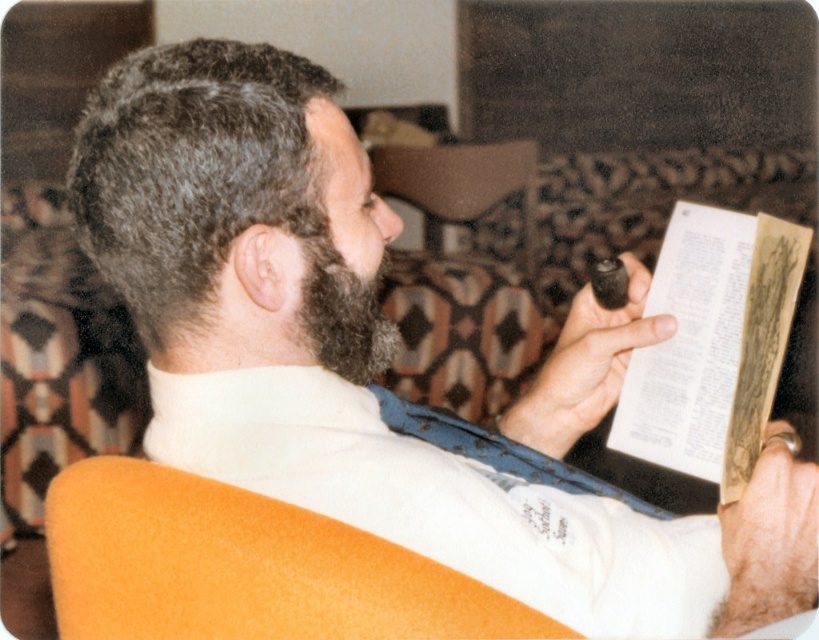
Question: Is orange fabric armchair at lower left to the left of dark brown fuzzy beard at center from the viewer's perspective?

Choices:
 (A) no
 (B) yes

Answer: (B)

Question: Which object is the closest to the dark brown fuzzy beard at center?

Choices:
 (A) orange fabric armchair at lower left
 (B) yellowed paper book at right

Answer: (A)

Question: Which point appears farthest from the camera in this image?

Choices:
 (A) (657, 257)
 (B) (133, 488)
 (C) (356, 360)

Answer: (A)

Question: Can you confirm if orange fabric armchair at lower left is wider than yellowed paper book at right?

Choices:
 (A) no
 (B) yes

Answer: (B)

Question: Can you confirm if yellowed paper book at right is bigger than dark brown fuzzy beard at center?

Choices:
 (A) yes
 (B) no

Answer: (A)

Question: Which point appears farthest from the camera in this image?

Choices:
 (A) (731, 323)
 (B) (322, 621)
 (C) (318, 221)

Answer: (A)